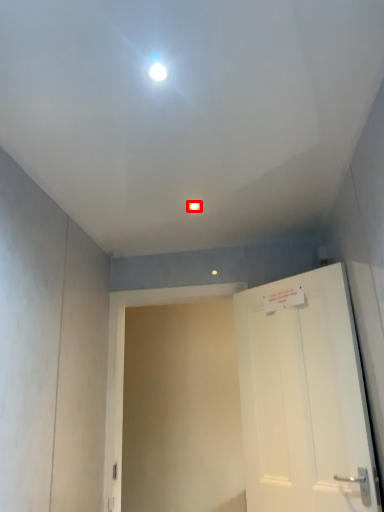
Question: From the image, what is the correct spatial relationship of light fixture (annotated by the red box) in relation to door?

Choices:
 (A) right
 (B) left

Answer: (B)